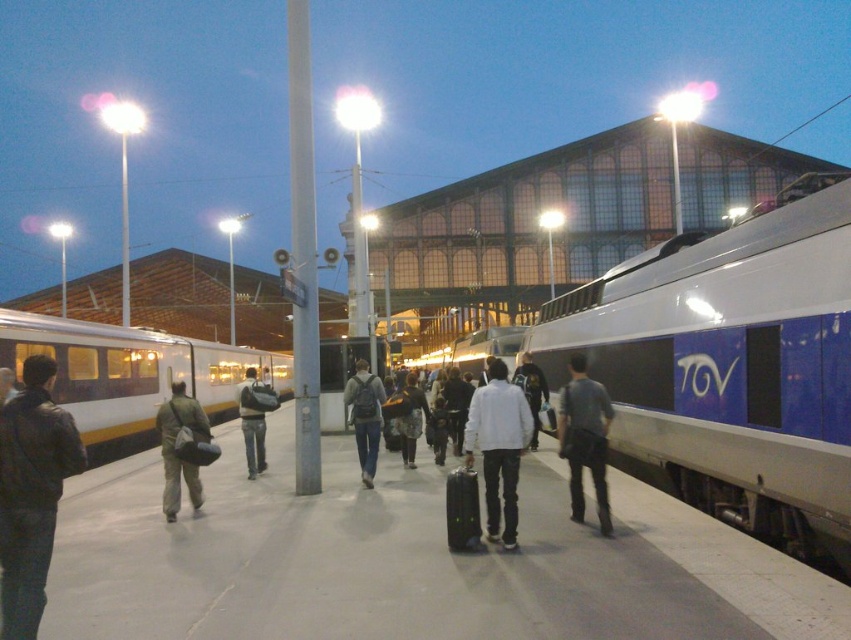
You are a traveler at the train station and see your gray fabric bag at center and a silver metallic train at center. Which object is positioned more to the left side of the platform?

The gray fabric bag at center is positioned more to the left side of the platform compared to the silver metallic train at center.

You are a maintenance worker on the train station platform. You need to move a gray fabric bag at center to a storage area located 8 meters away. Can you reach the storage area without moving the bag?

The gray fabric bag at center is 7.91 meters away from the storage area, so yes, you can reach the storage area without moving the bag since the distance is just under 8 meters.